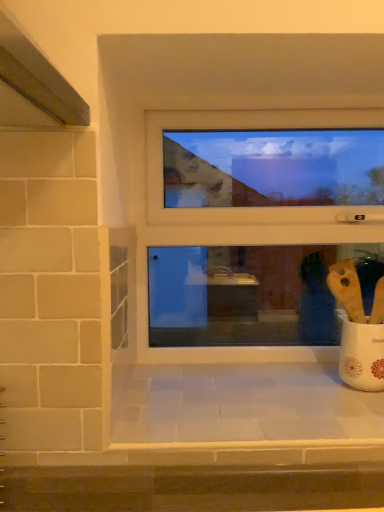
Find the location of a particular element. This screenshot has width=384, height=512. white glossy window at center is located at coordinates (240, 220).

The width and height of the screenshot is (384, 512). What do you see at coordinates (240, 220) in the screenshot?
I see `white glossy window at center` at bounding box center [240, 220].

Image resolution: width=384 pixels, height=512 pixels. In order to click on white glossy window at center in this screenshot , I will do coord(240,220).